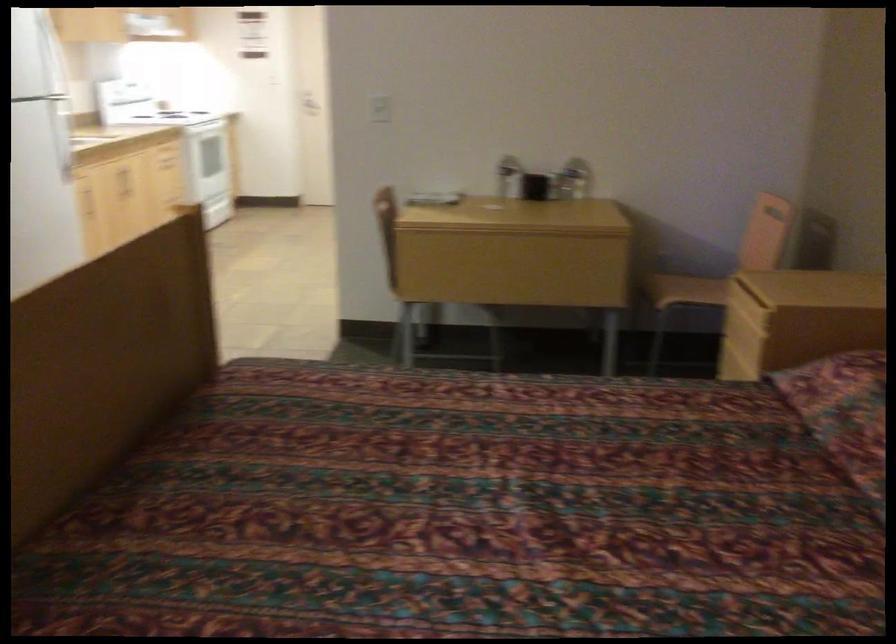
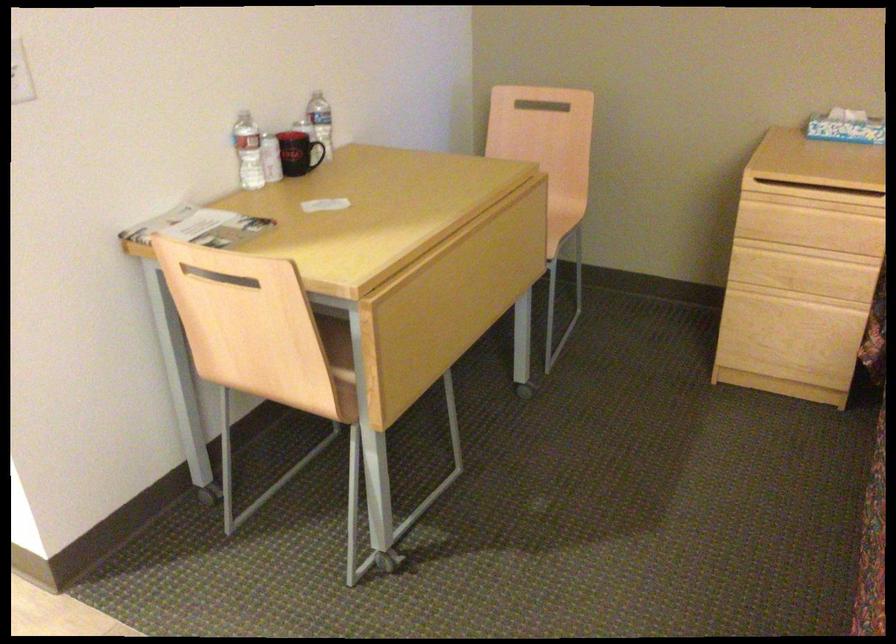
In the second image, find the point that corresponds to (x=755, y=303) in the first image.

(814, 196)